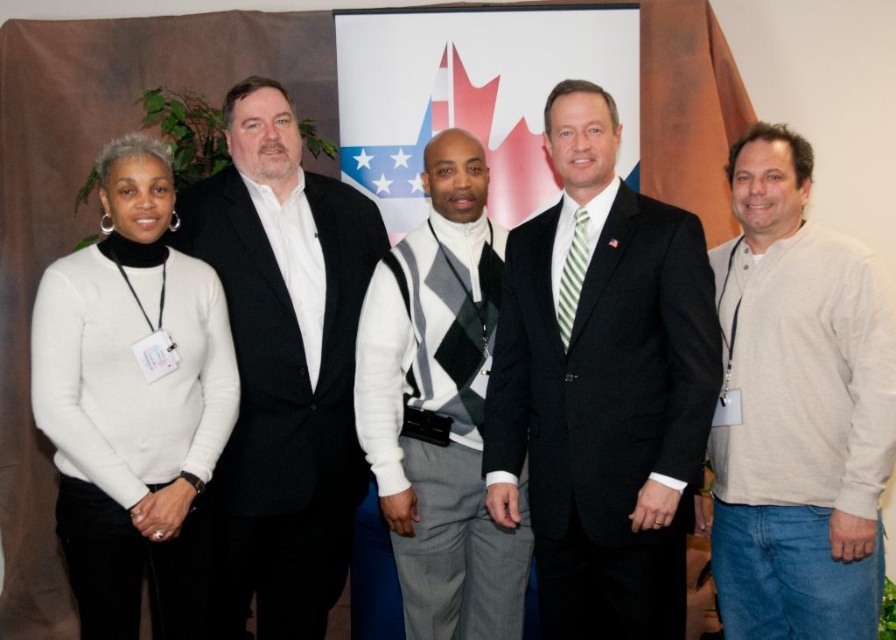
Question: Estimate the real-world distances between objects in this image. Which object is farther from the dark suit at center?

Choices:
 (A) black wool suit at center
 (B) white sweater at left
 (C) white argyle sweater vest at center

Answer: (B)

Question: Among these objects, which one is farthest from the camera?

Choices:
 (A) white sweater at left
 (B) black wool suit at center
 (C) white argyle sweater vest at center
 (D) dark suit at center

Answer: (C)

Question: Does dark suit at center come in front of black wool suit at center?

Choices:
 (A) yes
 (B) no

Answer: (A)

Question: Which point is closer to the camera?

Choices:
 (A) dark suit at center
 (B) white cotton sweater at right
 (C) white sweater at left

Answer: (C)

Question: Considering the relative positions of dark suit at center and white sweater at left in the image provided, where is dark suit at center located with respect to white sweater at left?

Choices:
 (A) above
 (B) below

Answer: (A)

Question: Does dark suit at center have a greater width compared to black wool suit at center?

Choices:
 (A) no
 (B) yes

Answer: (A)